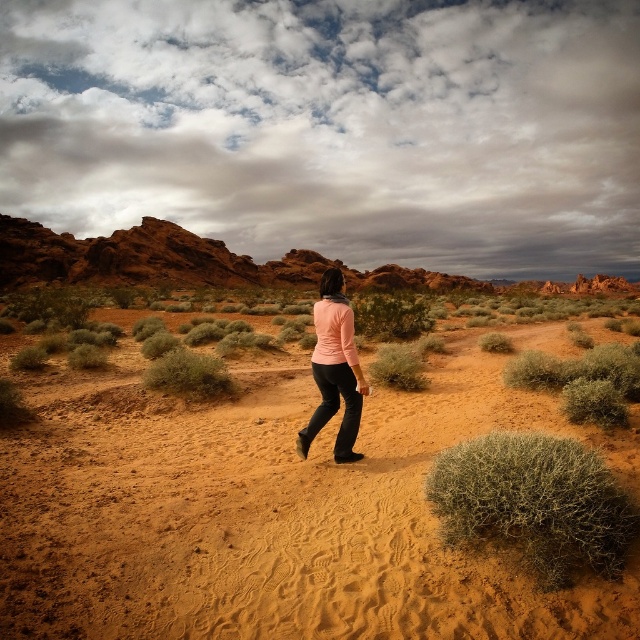
You are a hiker trying to navigate through the desert. You see the brown sandy dirt at center and the matte pink sweater at center. Which object is lower in height?

The brown sandy dirt at center is shorter than the matte pink sweater at center, so the brown sandy dirt at center is lower in height.

You are standing at the origin point in the desert scene. There is a point marked at coordinates (273, 512). What is located at that point?

The point at coordinates (273, 512) marks brown sandy dirt at center.

You are a photographer standing in the desert scene. You want to take a photo that includes both the point at coordinates (632, 636) and the point at (314, 412). Which point should you focus on first to ensure both are in clear focus?

You should focus on point (314, 412) first because it is farther from the camera than point (632, 636). By focusing on the farther point, the closer point will also be in focus due to the depth of field.